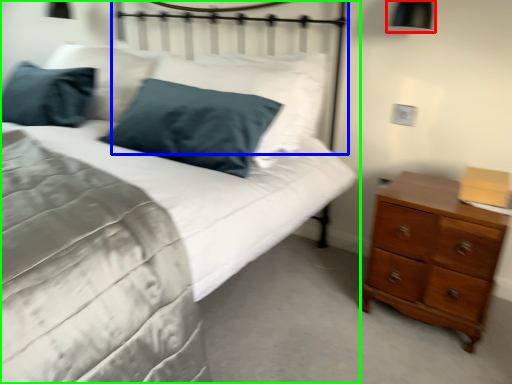
Question: Which object is the farthest from bedside lamp (highlighted by a red box)? Choose among these: headboard (highlighted by a blue box) or bed (highlighted by a green box).

Choices:
 (A) headboard
 (B) bed

Answer: (B)